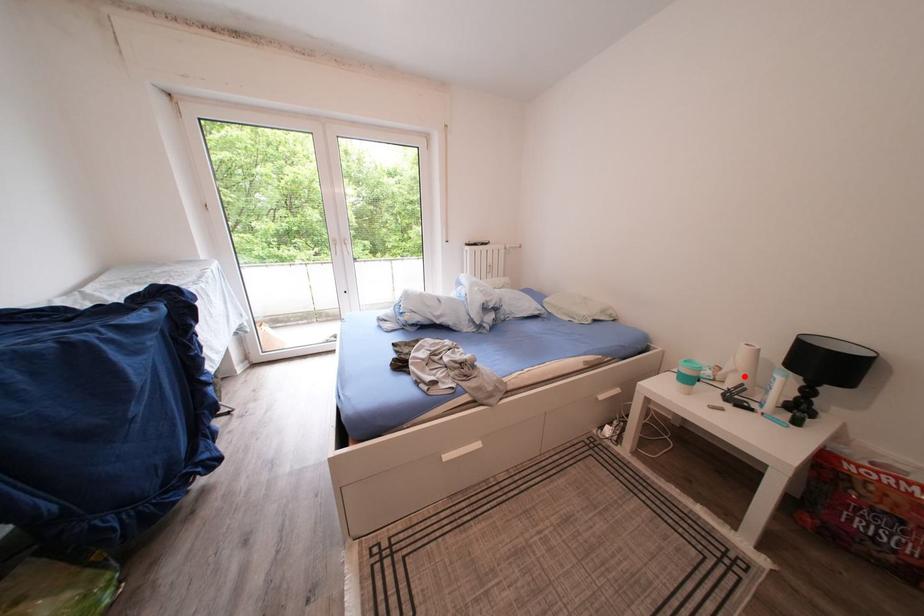
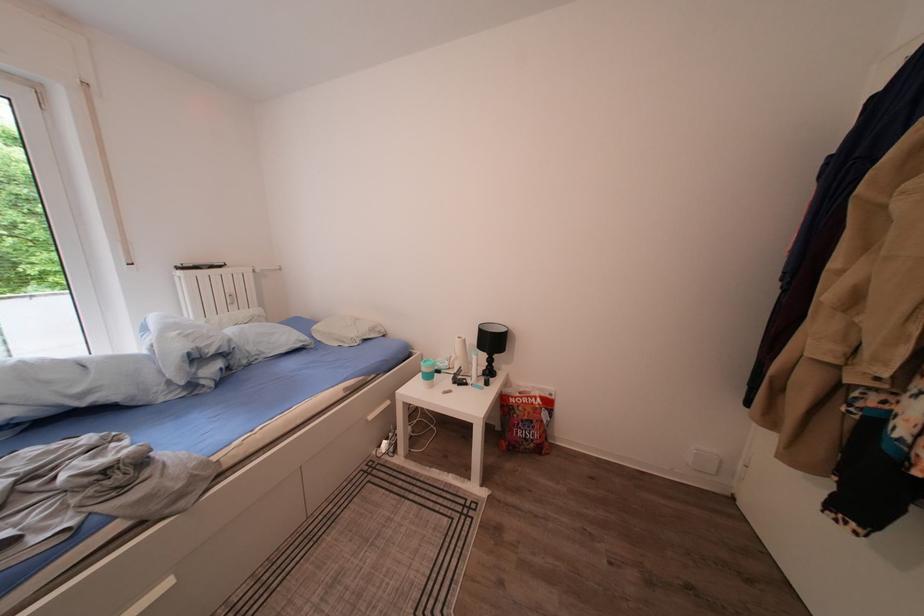
Locate, in the second image, the point that corresponds to the highlighted location in the first image.

(466, 363)